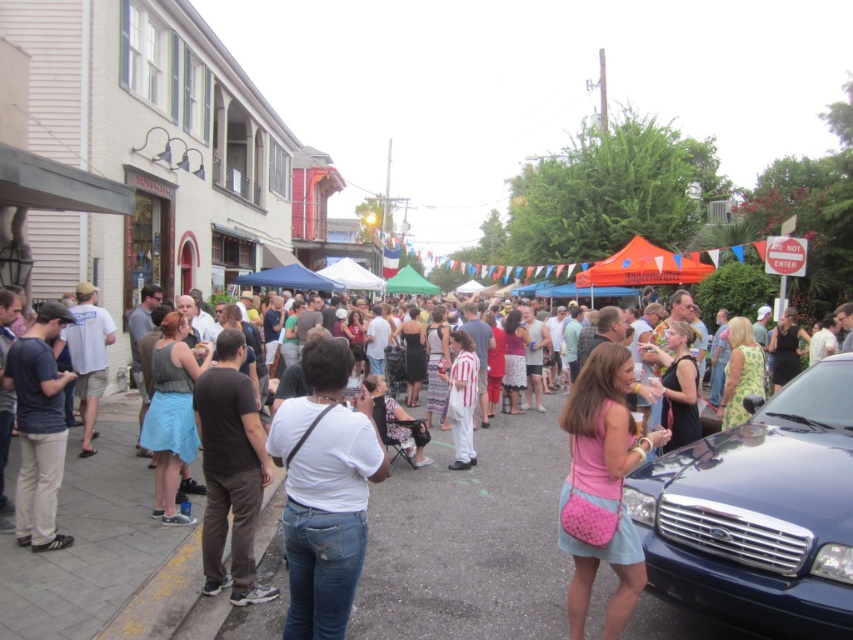
Question: In this image, where is dark brown cotton pants at left located relative to dark blue shirt at left?

Choices:
 (A) left
 (B) right

Answer: (B)

Question: Which point is closer to the camera?

Choices:
 (A) (239, 456)
 (B) (581, 396)
 (C) (712, 580)
 (D) (462, 381)

Answer: (C)

Question: Among these points, which one is farthest from the camera?

Choices:
 (A) (287, 556)
 (B) (370, 636)
 (C) (582, 465)
 (D) (73, 320)

Answer: (D)

Question: Does dark blue shirt at left come behind white striped dress at center?

Choices:
 (A) no
 (B) yes

Answer: (A)

Question: Estimate the real-world distances between objects in this image. Which object is closer to the white striped dress at center?

Choices:
 (A) pink fabric purse at center
 (B) dark blue shirt at left
 (C) dark brown cotton pants at left
 (D) shiny blue car at lower right

Answer: (C)

Question: From the image, what is the correct spatial relationship of pink fabric purse at center in relation to white striped dress at center?

Choices:
 (A) above
 (B) below

Answer: (B)